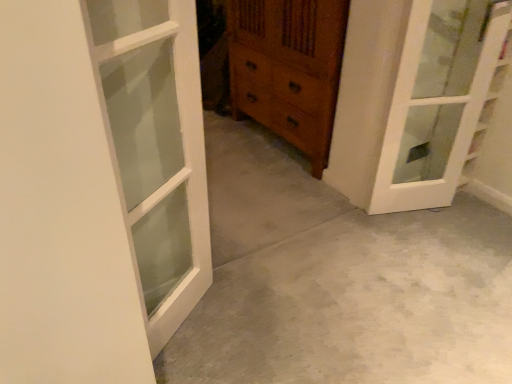
This screenshot has width=512, height=384. Find the location of `gray concrete at center`. gray concrete at center is located at coordinates (359, 304).

At what (x,y) coordinates should I click in order to perform the action: click on white glass door at upper right, the 1th door from the back. Please return your answer as a coordinate pair (x, y). The width and height of the screenshot is (512, 384). Looking at the image, I should click on (412, 99).

The width and height of the screenshot is (512, 384). What do you see at coordinates (288, 68) in the screenshot?
I see `wooden chest of drawers at center` at bounding box center [288, 68].

You are a GUI agent. You are given a task and a screenshot of the screen. Output one action in this format:
    pyautogui.click(x=<x>, y=<y>)
    Task: Click on the gray concrete at center
    
    Given the screenshot: What is the action you would take?
    pyautogui.click(x=359, y=304)

Is gray concrete at center next to white glass door at upper right, the 1th door from the back, and touching it?

No, gray concrete at center is not beside white glass door at upper right, the 1th door from the back.

Which point is more forward, (394, 336) or (382, 167)?

The point (394, 336) is closer.

In order to click on concrete on the left of the white glass door at upper right, which is counted as the first door, starting from the right in this screenshot , I will do `click(359, 304)`.

From the image's perspective, is gray concrete at center above or below white glass door at upper right, acting as the second door starting from the left?

gray concrete at center is situated lower than white glass door at upper right, acting as the second door starting from the left, in the image.

Is wooden chest of drawers at center bigger than white wood door at left, placed as the 1th door when sorted from front to back?

Correct, wooden chest of drawers at center is larger in size than white wood door at left, placed as the 1th door when sorted from front to back.

How many degrees apart are the facing directions of wooden chest of drawers at center and white wood door at left, placed as the 1th door when sorted from front to back?

There is a 120-degree angle between the facing directions of wooden chest of drawers at center and white wood door at left, placed as the 1th door when sorted from front to back.

Considering the positions of points (295, 71) and (142, 7), is point (295, 71) closer to camera compared to point (142, 7)?

That is False.

From a real-world perspective, which is physically below, wooden chest of drawers at center or white wood door at left, placed as the 1th door when sorted from left to right?

wooden chest of drawers at center is physically lower.

Are white glass door at upper right, acting as the second door starting from the left, and white wood door at left, placed as the 1th door when sorted from left to right, located far from each other?

Yes, white glass door at upper right, acting as the second door starting from the left, and white wood door at left, placed as the 1th door when sorted from left to right, are located far from each other.

Considering the positions of points (420, 68) and (70, 7), is point (420, 68) farther from camera compared to point (70, 7)?

That is True.

Can you confirm if white glass door at upper right, placed as the second door when sorted from front to back, is taller than white wood door at left, which appears as the second door when viewed from the back?

In fact, white glass door at upper right, placed as the second door when sorted from front to back, may be shorter than white wood door at left, which appears as the second door when viewed from the back.

Is white glass door at upper right, acting as the second door starting from the left, wider than white wood door at left, placed as the 1th door when sorted from front to back?

Yes, white glass door at upper right, acting as the second door starting from the left, is wider than white wood door at left, placed as the 1th door when sorted from front to back.

Considering the relative positions of white glass door at upper right, which is counted as the first door, starting from the right, and wooden chest of drawers at center in the image provided, is white glass door at upper right, which is counted as the first door, starting from the right, to the right of wooden chest of drawers at center from the viewer's perspective?

Indeed, white glass door at upper right, which is counted as the first door, starting from the right, is positioned on the right side of wooden chest of drawers at center.

Does white glass door at upper right, which is counted as the first door, starting from the right, have a lesser width compared to wooden chest of drawers at center?

Yes, white glass door at upper right, which is counted as the first door, starting from the right, is thinner than wooden chest of drawers at center.

From a real-world perspective, is white glass door at upper right, acting as the second door starting from the left, on wooden chest of drawers at center?

Yes, from a real-world perspective, white glass door at upper right, acting as the second door starting from the left, is on top of wooden chest of drawers at center.

Who is smaller, white glass door at upper right, placed as the second door when sorted from front to back, or wooden chest of drawers at center?

Smaller between the two is white glass door at upper right, placed as the second door when sorted from front to back.

Between wooden chest of drawers at center and white glass door at upper right, placed as the second door when sorted from front to back, which one is positioned behind?

Positioned behind is wooden chest of drawers at center.

Is wooden chest of drawers at center far from white glass door at upper right, which is counted as the first door, starting from the right?

No, wooden chest of drawers at center is in close proximity to white glass door at upper right, which is counted as the first door, starting from the right.

Considering the relative sizes of wooden chest of drawers at center and white glass door at upper right, acting as the second door starting from the left, in the image provided, is wooden chest of drawers at center thinner than white glass door at upper right, acting as the second door starting from the left,?

In fact, wooden chest of drawers at center might be wider than white glass door at upper right, acting as the second door starting from the left.

In the image, there is a white wood door at left, placed as the 1th door when sorted from front to back. Identify the location of door below it (from a real-world perspective). (412, 99).

How much distance is there between white wood door at left, placed as the 1th door when sorted from front to back, and white glass door at upper right, which is counted as the first door, starting from the right?

white wood door at left, placed as the 1th door when sorted from front to back, is 3.71 feet from white glass door at upper right, which is counted as the first door, starting from the right.

From a real-world perspective, which object stands above the other?

white wood door at left, placed as the 1th door when sorted from left to right, from a real-world perspective.

From the image's perspective, is wooden chest of drawers at center positioned above or below gray concrete at center?

wooden chest of drawers at center is situated higher than gray concrete at center in the image.

Does wooden chest of drawers at center have a greater width compared to gray concrete at center?

Incorrect, the width of wooden chest of drawers at center does not surpass that of gray concrete at center.

Identify the location of concrete below the wooden chest of drawers at center (from the image's perspective). The width and height of the screenshot is (512, 384). (359, 304).

Is wooden chest of drawers at center situated inside gray concrete at center or outside?

wooden chest of drawers at center lies outside gray concrete at center.

The height and width of the screenshot is (384, 512). What are the coordinates of `concrete directly beneath the white glass door at upper right, which is counted as the first door, starting from the right (from a real-world perspective)` in the screenshot? It's located at (359, 304).

You are a GUI agent. You are given a task and a screenshot of the screen. Output one action in this format:
    pyautogui.click(x=<x>, y=<y>)
    Task: Click on the door that is the 2nd object located in front of the wooden chest of drawers at center
    
    Given the screenshot: What is the action you would take?
    pyautogui.click(x=99, y=187)

Which object lies nearer to the anchor point white glass door at upper right, the 1th door from the back, gray concrete at center or white wood door at left, which appears as the second door when viewed from the back?

Based on the image, gray concrete at center appears to be nearer to white glass door at upper right, the 1th door from the back.

Estimate the real-world distances between objects in this image. Which object is closer to white wood door at left, which appears as the second door when viewed from the back, white glass door at upper right, which is counted as the first door, starting from the right, or gray concrete at center?

gray concrete at center is closer to white wood door at left, which appears as the second door when viewed from the back.

Which object lies further to the anchor point white wood door at left, which appears as the second door when viewed from the back, wooden chest of drawers at center or white glass door at upper right, acting as the second door starting from the left?

wooden chest of drawers at center lies further to white wood door at left, which appears as the second door when viewed from the back, than the other object.

From the image, which object appears to be farther from gray concrete at center, wooden chest of drawers at center or white glass door at upper right, placed as the second door when sorted from front to back?

wooden chest of drawers at center is further to gray concrete at center.

Estimate the real-world distances between objects in this image. Which object is closer to gray concrete at center, white glass door at upper right, the 1th door from the back, or white wood door at left, which appears as the second door when viewed from the back?

Based on the image, white glass door at upper right, the 1th door from the back, appears to be nearer to gray concrete at center.

Which object lies nearer to the anchor point white glass door at upper right, acting as the second door starting from the left, white wood door at left, placed as the 1th door when sorted from front to back, or wooden chest of drawers at center?

wooden chest of drawers at center is closer to white glass door at upper right, acting as the second door starting from the left.

Based on their spatial positions, is white glass door at upper right, acting as the second door starting from the left, or gray concrete at center closer to wooden chest of drawers at center?

white glass door at upper right, acting as the second door starting from the left, lies closer to wooden chest of drawers at center than the other object.

Considering their positions, is white glass door at upper right, acting as the second door starting from the left, positioned further to gray concrete at center than wooden chest of drawers at center?

wooden chest of drawers at center lies further to gray concrete at center than the other object.

Image resolution: width=512 pixels, height=384 pixels. Identify the location of concrete between white wood door at left, which appears as the second door when viewed from the back, and white glass door at upper right, acting as the second door starting from the left, from left to right. (359, 304).

You are a GUI agent. You are given a task and a screenshot of the screen. Output one action in this format:
    pyautogui.click(x=<x>, y=<y>)
    Task: Click on the chest of drawers situated between white wood door at left, placed as the 1th door when sorted from left to right, and white glass door at upper right, the 1th door from the back, from left to right
    
    Given the screenshot: What is the action you would take?
    pyautogui.click(x=288, y=68)